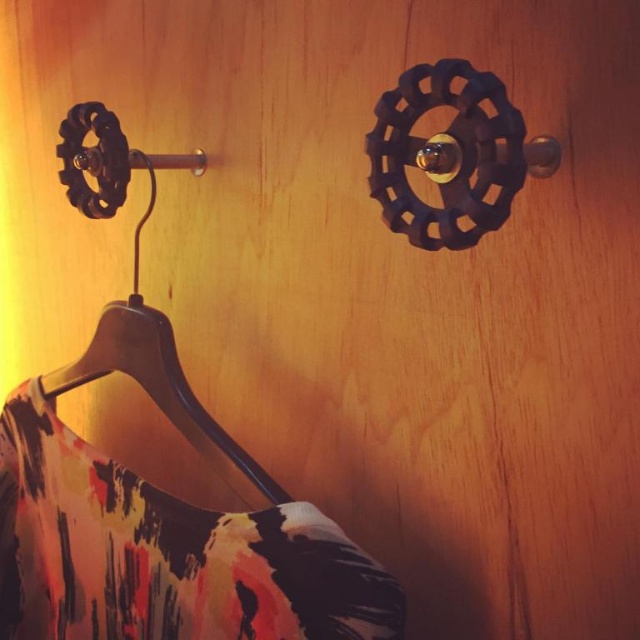
Does printed fabric dress at lower left appear on the left side of wooden hanger at lower left?

Indeed, printed fabric dress at lower left is positioned on the left side of wooden hanger at lower left.

Is the position of printed fabric dress at lower left more distant than that of wooden hanger at lower left?

No, printed fabric dress at lower left is closer to the viewer.

Who is more forward, (202, 512) or (268, 493)?

Point (268, 493) is more forward.

Locate an element on the screen. printed fabric dress at lower left is located at coordinates (163, 554).